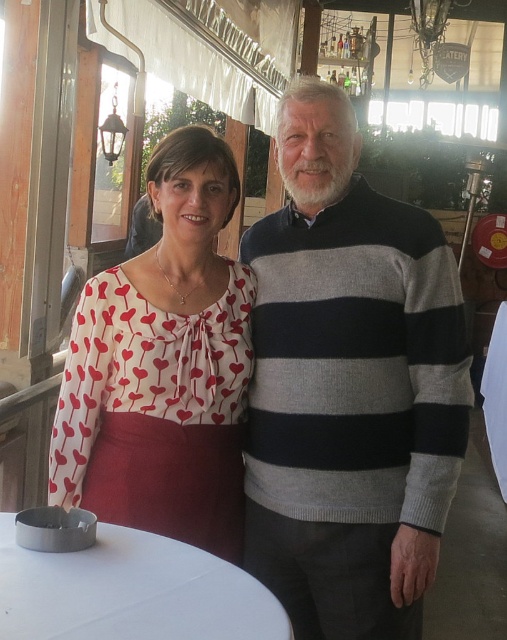
Question: Is white printed blouse at center bigger than white glossy round table at lower left?

Choices:
 (A) no
 (B) yes

Answer: (B)

Question: Can you confirm if striped sweater at center is positioned to the left of white printed blouse at center?

Choices:
 (A) no
 (B) yes

Answer: (A)

Question: Does white glossy round table at lower left come in front of red cotton apron at lower left?

Choices:
 (A) yes
 (B) no

Answer: (A)

Question: Which object is the closest to the white glossy round table at lower left?

Choices:
 (A) white printed blouse at center
 (B) striped sweater at center

Answer: (A)

Question: Considering the real-world distances, which object is closest to the striped sweater at center?

Choices:
 (A) white printed blouse at center
 (B) white glossy round table at lower left
 (C) red cotton apron at lower left

Answer: (A)

Question: Which point is farther from the camera taking this photo?

Choices:
 (A) [x=56, y=573]
 (B) [x=73, y=460]
 (C) [x=386, y=220]
 (D) [x=123, y=422]

Answer: (B)